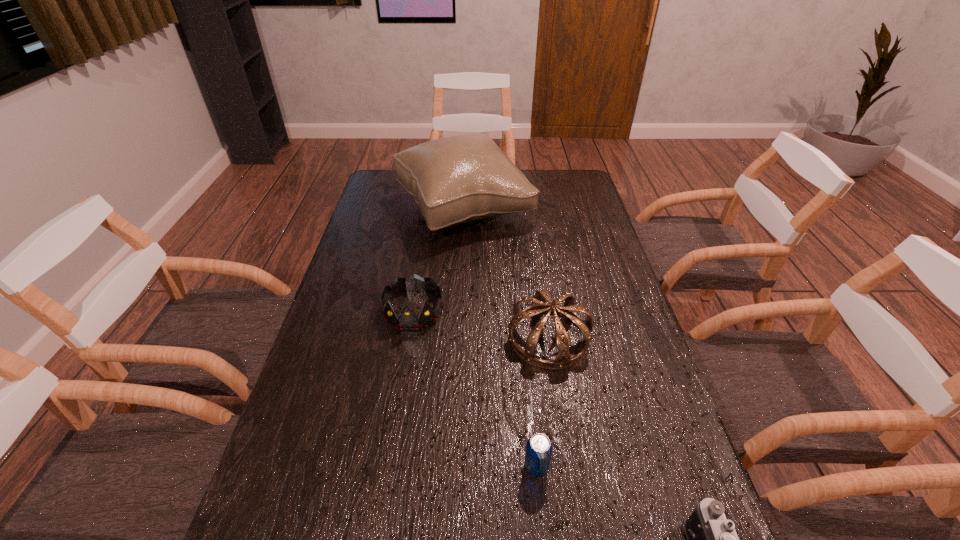
Find the location of a particular element. Image resolution: width=960 pixels, height=540 pixels. free region located on the back of the beer can is located at coordinates (531, 414).

At what (x,y) coordinates should I click in order to perform the action: click on object present at the far edge. Please return your answer as a coordinate pair (x, y). The width and height of the screenshot is (960, 540). Looking at the image, I should click on (463, 178).

In order to click on cushion that is positioned at the left edge in this screenshot , I will do `click(463, 178)`.

Identify the location of tiara located in the left edge section of the desktop. The width and height of the screenshot is (960, 540). (407, 320).

You are a GUI agent. You are given a task and a screenshot of the screen. Output one action in this format:
    pyautogui.click(x=<x>, y=<y>)
    Task: Click on the object that is at the right edge
    The image size is (960, 540).
    Given the screenshot: What is the action you would take?
    pyautogui.click(x=563, y=360)

What are the coordinates of `object that is at the far left corner` in the screenshot? It's located at (463, 178).

At what (x,y) coordinates should I click in order to perform the action: click on vacant space at the left edge. Please return your answer as a coordinate pair (x, y). This screenshot has height=540, width=960. Looking at the image, I should click on point(347,272).

Find the location of a particular element. free region at the right edge of the desktop is located at coordinates (676, 500).

At what (x,y) coordinates should I click in order to perform the action: click on free space at the far left corner of the desktop. Please return your answer as a coordinate pair (x, y). This screenshot has height=540, width=960. Looking at the image, I should click on (386, 193).

Locate an element on the screen. The height and width of the screenshot is (540, 960). free point between the cushion and the right tiara is located at coordinates (507, 273).